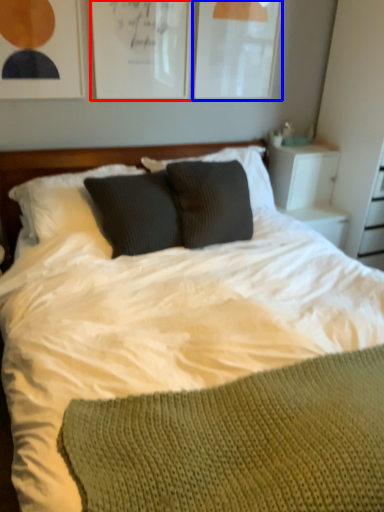
Question: Which object is closer to the camera taking this photo, picture frame (highlighted by a red box) or picture frame (highlighted by a blue box)?

Choices:
 (A) picture frame
 (B) picture frame

Answer: (A)